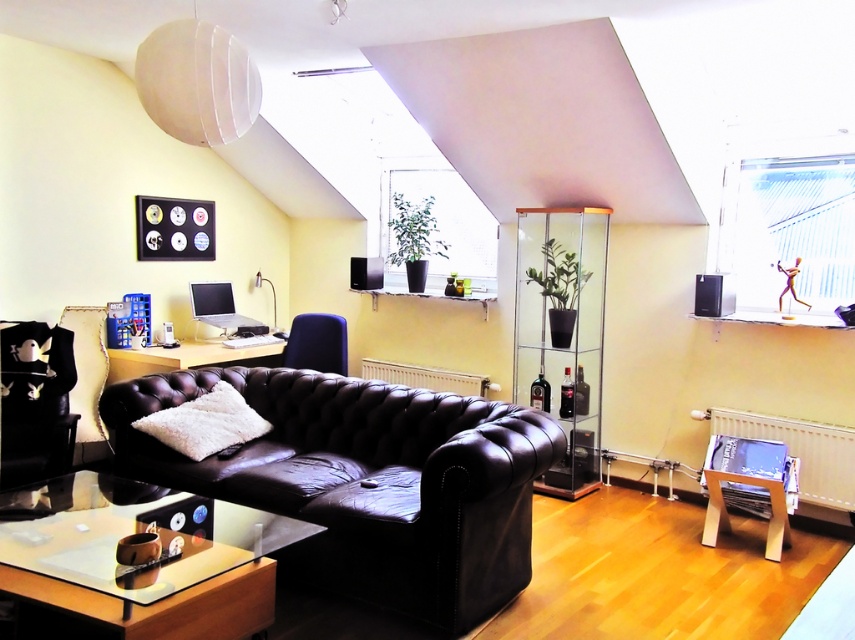
Question: Which of the following is the closest to the observer?

Choices:
 (A) transparent glass table at lower center
 (B) translucent glass table at center
 (C) black matte speaker at upper right
 (D) black plastic speaker at center

Answer: (A)

Question: Is matte black leather couch at center positioned in front of black leather armchair at left?

Choices:
 (A) yes
 (B) no

Answer: (A)

Question: Does matte blue armchair at center have a smaller size compared to black plastic speaker at center?

Choices:
 (A) yes
 (B) no

Answer: (B)

Question: Is transparent glass table at lower center below translucent glass table at center?

Choices:
 (A) no
 (B) yes

Answer: (B)

Question: Which is nearer to the transparent glass table at lower center?

Choices:
 (A) matte blue armchair at center
 (B) matte black leather couch at center
 (C) black leather armchair at left
 (D) black plastic speaker at center

Answer: (B)

Question: Which object is farther from the camera taking this photo?

Choices:
 (A) black leather armchair at left
 (B) matte black leather couch at center
 (C) black plastic speaker at center

Answer: (C)